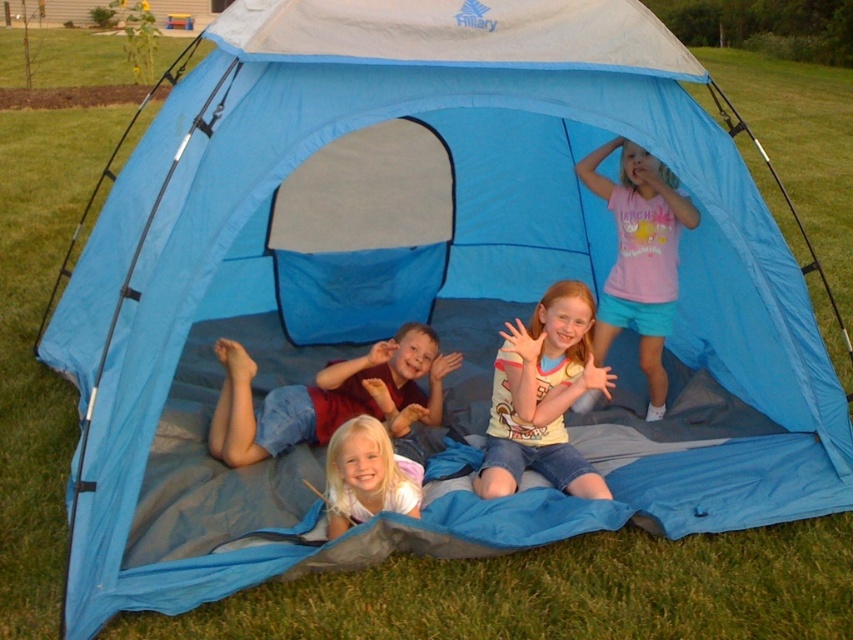
The height and width of the screenshot is (640, 853). What do you see at coordinates (326, 396) in the screenshot? I see `light blonde hair at center` at bounding box center [326, 396].

Between light blonde hair at center and pink cotton shirt at upper center, which one is positioned higher?

pink cotton shirt at upper center

Which is in front, point (311, 388) or point (618, 307)?

Positioned in front is point (311, 388).

The width and height of the screenshot is (853, 640). I want to click on light blonde hair at center, so click(326, 396).

Does striped cotton shirt at center have a lesser height compared to pink cotton shirt at upper center?

Yes.

Is striped cotton shirt at center behind pink cotton shirt at upper center?

No, striped cotton shirt at center is closer to the viewer.

Is point (563, 476) positioned before point (602, 156)?

Yes, point (563, 476) is in front of point (602, 156).

Locate an element on the screen. striped cotton shirt at center is located at coordinates (543, 396).

Locate an element on the screen. The width and height of the screenshot is (853, 640). pink cotton shirt at upper center is located at coordinates (639, 257).

Is pink cotton shirt at upper center taller than smooth white shirt at center?

Indeed, pink cotton shirt at upper center has a greater height compared to smooth white shirt at center.

Does point (621, 282) lie behind point (341, 448)?

Yes.

At what (x,y) coordinates should I click in order to perform the action: click on pink cotton shirt at upper center. Please return your answer as a coordinate pair (x, y). Looking at the image, I should click on (639, 257).